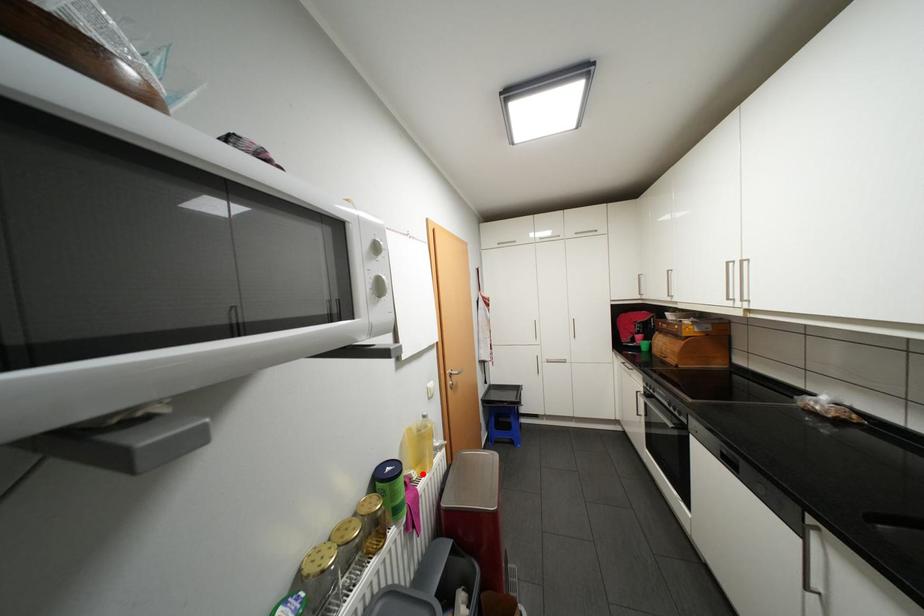
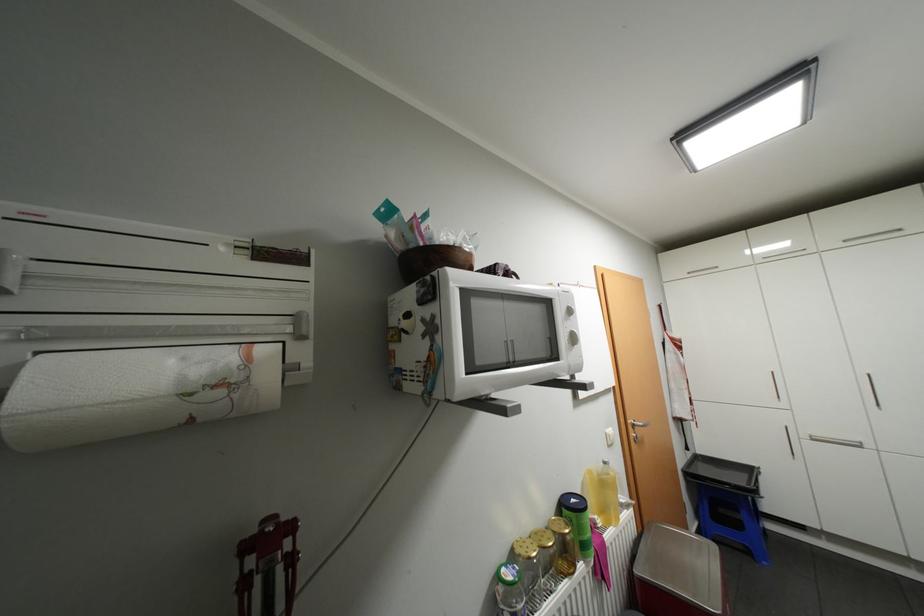
In the second image, find the point that corresponds to the highlighted location in the first image.

(606, 521)